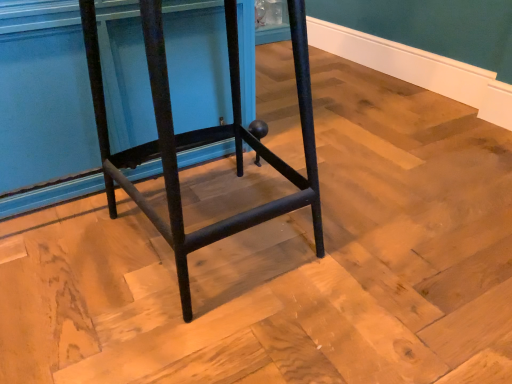
What do you see at coordinates (202, 139) in the screenshot?
I see `black metal stool at center` at bounding box center [202, 139].

The image size is (512, 384). Find the location of `black metal stool at center`. black metal stool at center is located at coordinates (202, 139).

The height and width of the screenshot is (384, 512). I want to click on black metal stool at center, so click(202, 139).